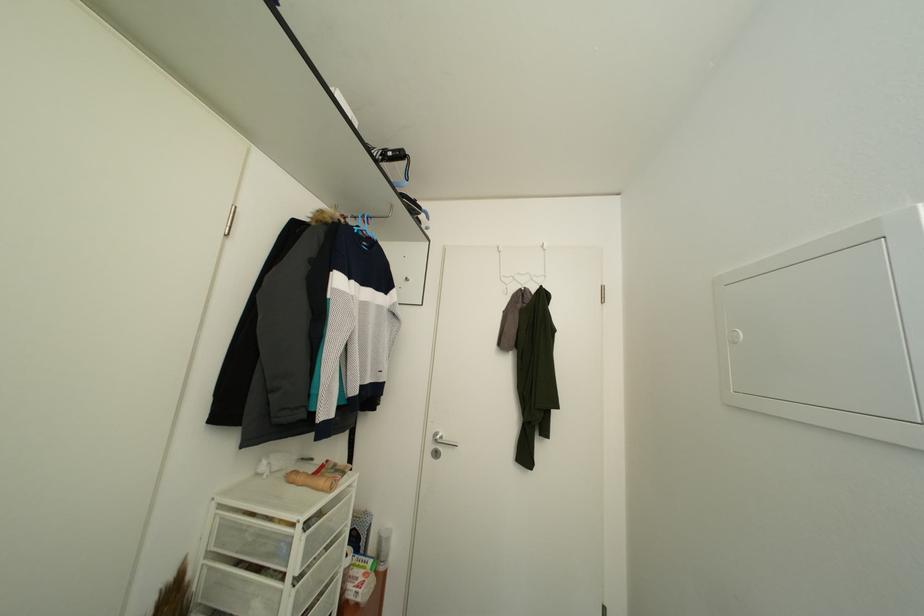
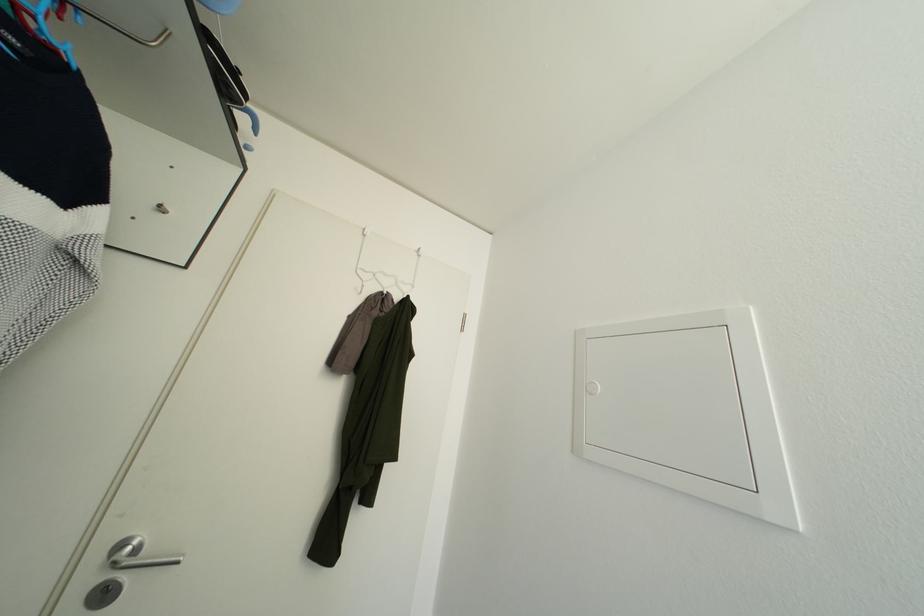
Where in the second image is the point corresponding to [446,439] from the first image?

(142, 546)